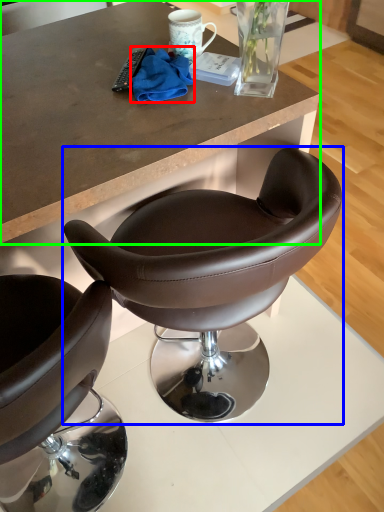
Question: Based on their relative distances, which object is farther from material (highlighted by a red box)? Choose from chair (highlighted by a blue box) and desk (highlighted by a green box).

Choices:
 (A) chair
 (B) desk

Answer: (A)